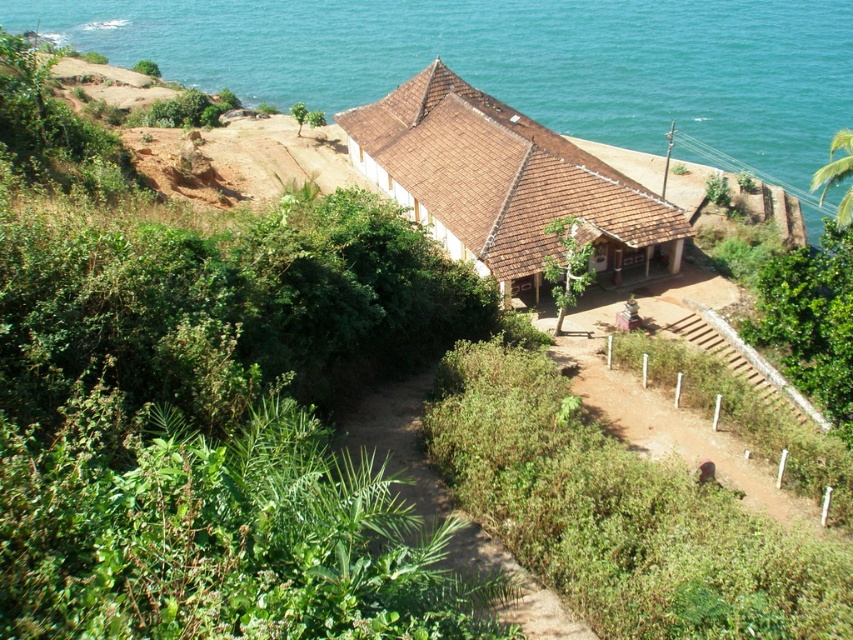
Does blue water at upper center have a lesser height compared to brown tiled hut at center?

Incorrect, blue water at upper center's height does not fall short of brown tiled hut at center's.

Who is more forward, (x=589, y=36) or (x=491, y=221)?

Positioned in front is point (x=491, y=221).

Locate an element on the screen. The image size is (853, 640). blue water at upper center is located at coordinates (519, 65).

Between brown tiled hut at center and dried dirt path at center, which one is positioned higher?

Positioned higher is brown tiled hut at center.

Is brown tiled hut at center taller than dried dirt path at center?

Indeed, brown tiled hut at center has a greater height compared to dried dirt path at center.

Who is more distant from viewer, (428, 177) or (405, 451)?

The point (428, 177) is more distant.

At what (x,y) coordinates should I click in order to perform the action: click on brown tiled hut at center. Please return your answer as a coordinate pair (x, y). Looking at the image, I should click on (505, 184).

Which is above, blue water at upper center or dried dirt path at center?

blue water at upper center is higher up.

Does blue water at upper center have a smaller size compared to dried dirt path at center?

No.

Is point (732, 10) positioned behind point (374, 412)?

Yes.

What are the coordinates of `blue water at upper center` in the screenshot? It's located at (519, 65).